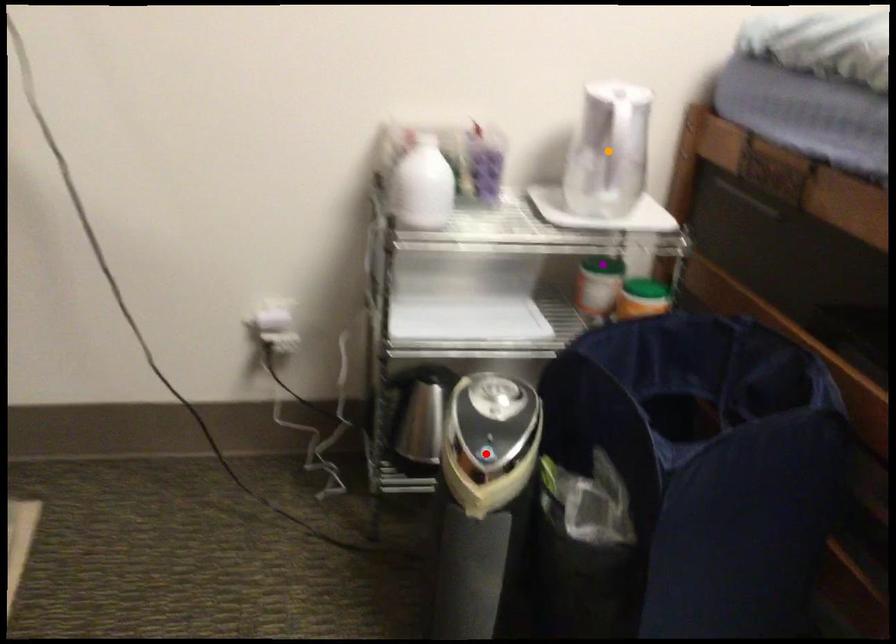
Based on the photo, order these from nearest to farthest:
A) red point
B) purple point
C) orange point

purple point < orange point < red point